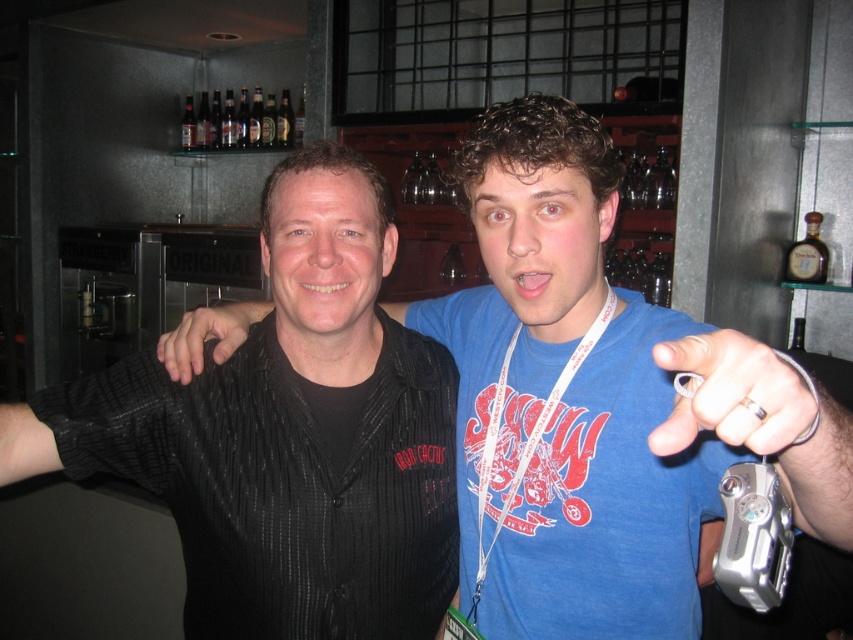
Question: Is black textured shirt at center wider than black matte hand at center?

Choices:
 (A) no
 (B) yes

Answer: (B)

Question: Among these points, which one is nearest to the camera?

Choices:
 (A) (219, 307)
 (B) (248, 112)

Answer: (A)

Question: Is black textured shirt at center above black ribbed shirt at center?

Choices:
 (A) no
 (B) yes

Answer: (B)

Question: Estimate the real-world distances between objects in this image. Which object is closer to the black matte hand at center?

Choices:
 (A) black ribbed shirt at center
 (B) clear glass bottles at upper center
 (C) silver metallic ring at right

Answer: (A)

Question: In this image, where is black ribbed shirt at center located relative to silver metallic ring at right?

Choices:
 (A) right
 (B) left

Answer: (B)

Question: Among these objects, which one is farthest from the camera?

Choices:
 (A) black matte hand at center
 (B) silver metallic ring at right
 (C) black ribbed shirt at center

Answer: (A)